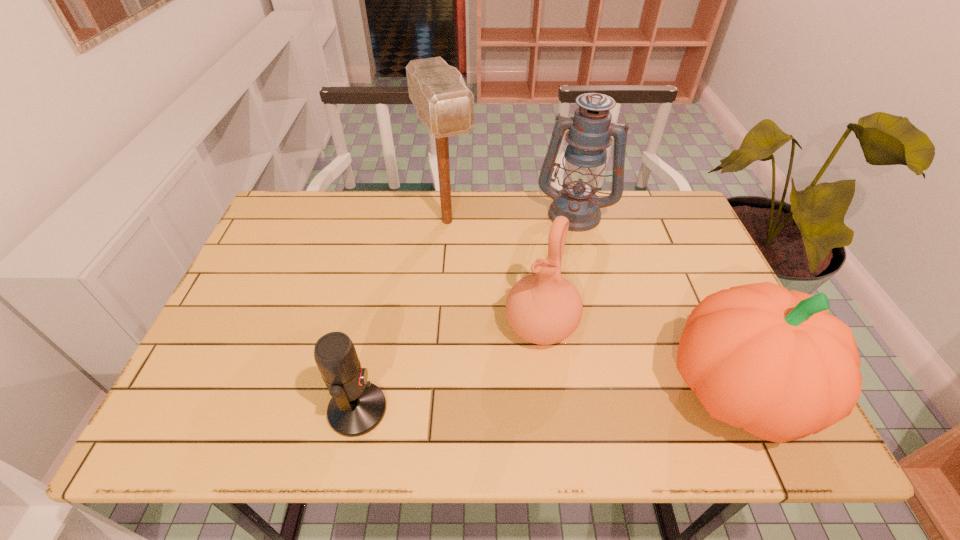
Locate an element on the screen. The height and width of the screenshot is (540, 960). free space that is in between the pumpkin and the shortest object is located at coordinates (547, 401).

I want to click on empty space that is in between the lantern and the mallet, so click(x=511, y=217).

Identify the location of empty location between the leftmost object and the pottery. The image size is (960, 540). (449, 368).

The height and width of the screenshot is (540, 960). In order to click on free space between the pottery and the mallet in this screenshot , I will do `click(494, 274)`.

I want to click on blank region between the pumpkin and the second object from left to right, so click(592, 306).

Where is `free spot between the second object from left to right and the microphone`? The image size is (960, 540). free spot between the second object from left to right and the microphone is located at coordinates (402, 315).

Select which object is the fourth closest to the pottery. Please provide its 2D coordinates. Your answer should be formatted as a tuple, i.e. [(x, y)], where the tuple contains the x and y coordinates of a point satisfying the conditions above.

[(590, 130)]

Identify which object is the third closest to the mallet. Please provide its 2D coordinates. Your answer should be formatted as a tuple, i.e. [(x, y)], where the tuple contains the x and y coordinates of a point satisfying the conditions above.

[(357, 406)]

At what (x,y) coordinates should I click in order to perform the action: click on vacant region that satisfies the following two spatial constraints: 1. on the front side of the mallet; 2. on the right side of the pottery. Please return your answer as a coordinate pair (x, y). The height and width of the screenshot is (540, 960). Looking at the image, I should click on (x=439, y=327).

Locate an element on the screen. This screenshot has width=960, height=540. free space that satisfies the following two spatial constraints: 1. on the front side of the pumpkin; 2. on the right side of the lantern is located at coordinates (617, 392).